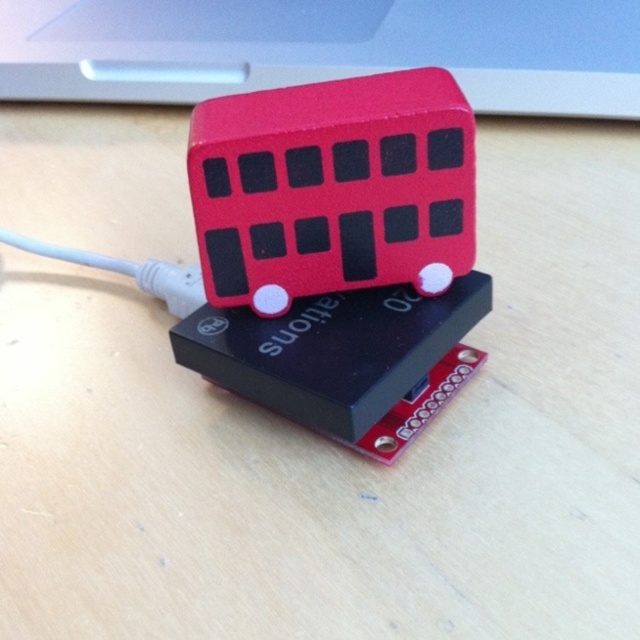
Question: Which of the following is the farthest from the observer?

Choices:
 (A) matte red bus at upper center
 (B) rubber bus at center

Answer: (A)

Question: Does matte red bus at upper center lie behind rubber bus at center?

Choices:
 (A) no
 (B) yes

Answer: (B)

Question: Does matte red bus at upper center have a smaller size compared to rubber bus at center?

Choices:
 (A) no
 (B) yes

Answer: (A)

Question: Which object appears farthest from the camera in this image?

Choices:
 (A) rubber bus at center
 (B) matte red bus at upper center

Answer: (B)

Question: Among these points, which one is farthest from the camera?

Choices:
 (A) (321, 138)
 (B) (449, 58)

Answer: (B)

Question: Is matte red bus at upper center closer to camera compared to rubber bus at center?

Choices:
 (A) no
 (B) yes

Answer: (A)